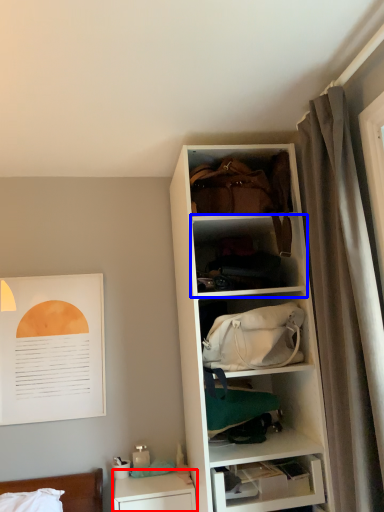
Question: Which point is closer to the camera, table (highlighted by a red box) or shelf (highlighted by a blue box)?

Choices:
 (A) table
 (B) shelf

Answer: (B)